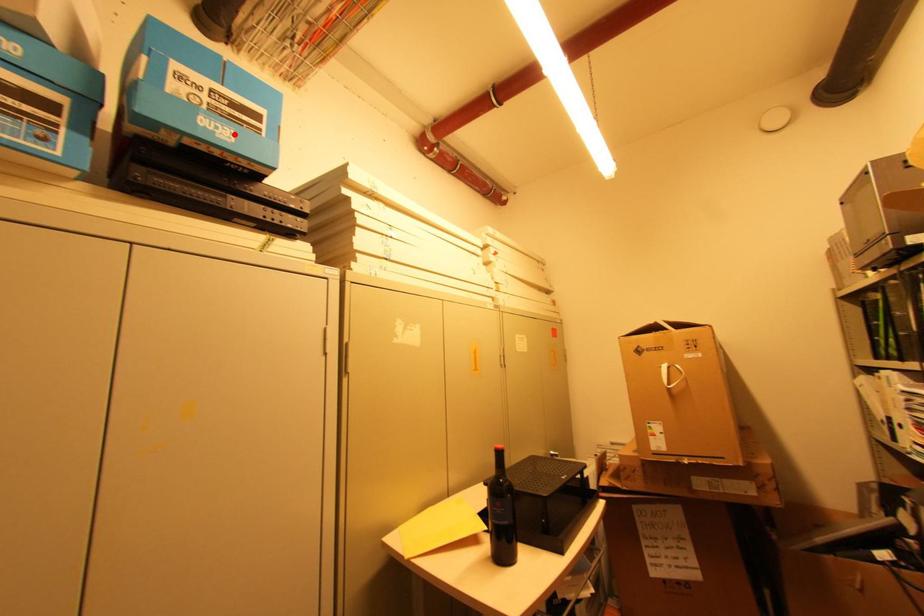
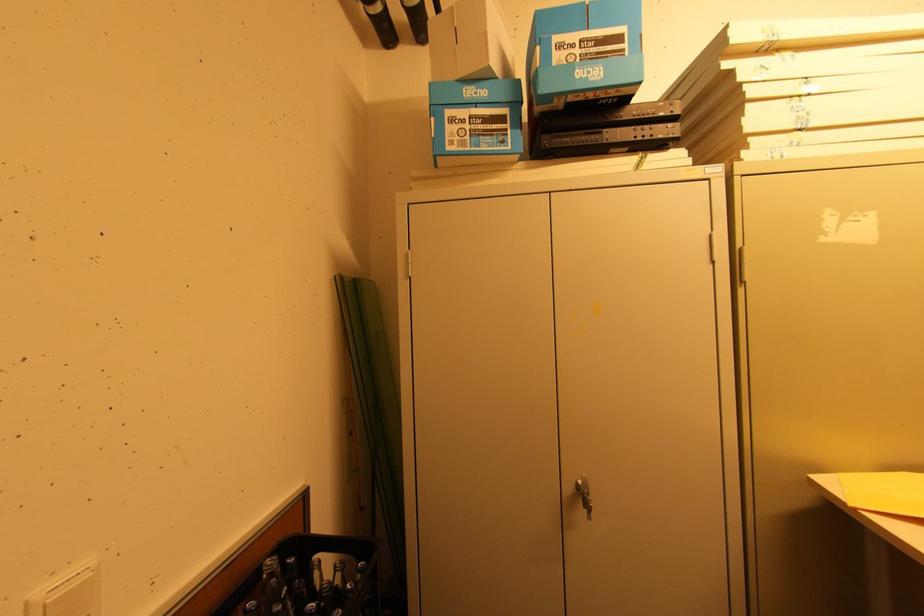
In the second image, find the point that corresponds to the highlighted location in the first image.

(603, 71)